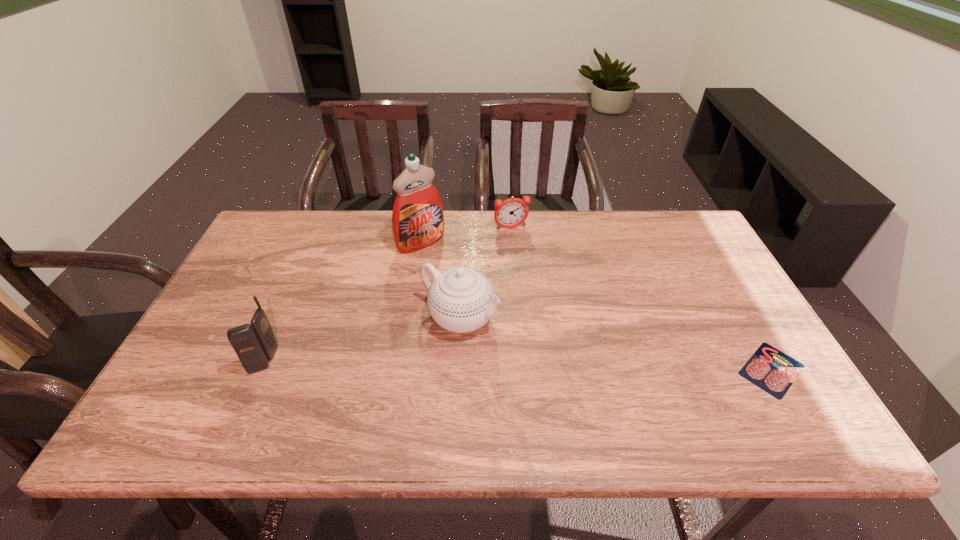
Where is `free space located on the spout of the chinaware`? free space located on the spout of the chinaware is located at coordinates (511, 343).

The height and width of the screenshot is (540, 960). What are the coordinates of `blank area located 0.250m on the spout of the chinaware` in the screenshot? It's located at (581, 381).

The height and width of the screenshot is (540, 960). In order to click on free spot located 0.170m on the spout of the chinaware in this screenshot , I will do `click(550, 364)`.

Where is `free space located 0.180m on the front surface of the tallest object`? Image resolution: width=960 pixels, height=540 pixels. free space located 0.180m on the front surface of the tallest object is located at coordinates (468, 285).

Where is `vacant space situated 0.320m on the front surface of the tallest object`? This screenshot has height=540, width=960. vacant space situated 0.320m on the front surface of the tallest object is located at coordinates (x=500, y=314).

The width and height of the screenshot is (960, 540). In order to click on vacant space located on the front surface of the tallest object in this screenshot , I will do `click(446, 264)`.

Locate an element on the screen. blank space located on the front-facing side of the alarm clock is located at coordinates (553, 313).

This screenshot has height=540, width=960. Find the location of `free space located on the front-facing side of the alarm clock`. free space located on the front-facing side of the alarm clock is located at coordinates (557, 321).

This screenshot has height=540, width=960. I want to click on free point located 0.130m on the front-facing side of the alarm clock, so click(x=527, y=258).

The image size is (960, 540). Identify the location of detergent that is positioned at the far edge. click(x=417, y=218).